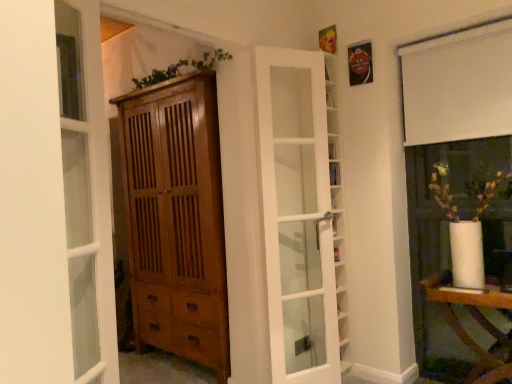
Question: In terms of width, does white matte curtain at upper right look wider or thinner when compared to clear glass door at left?

Choices:
 (A) thin
 (B) wide

Answer: (B)

Question: Considering the positions of white matte curtain at upper right and clear glass door at left in the image, is white matte curtain at upper right bigger or smaller than clear glass door at left?

Choices:
 (A) small
 (B) big

Answer: (B)

Question: Considering the real-world distances, which object is farthest from the wooden cabinet at center?

Choices:
 (A) white glass door at center
 (B) white matte curtain at upper right
 (C) clear glass door at left
 (D) white glossy table at lower right

Answer: (D)

Question: Estimate the real-world distances between objects in this image. Which object is farther from the white matte curtain at upper right?

Choices:
 (A) wooden cabinet at center
 (B) clear glass door at left
 (C) white glossy table at lower right
 (D) white glass door at center

Answer: (B)